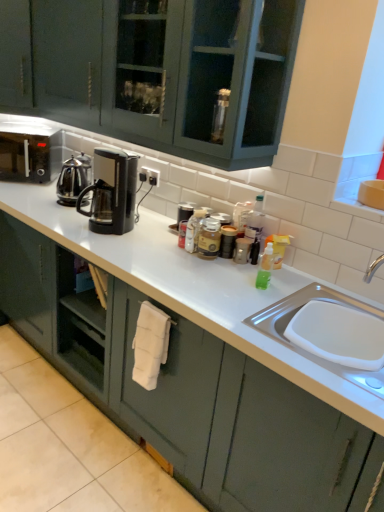
Question: Does black plastic coffee maker at center, which ranks as the 2th kitchen appliance in left-to-right order, have a lesser width compared to metallic silver canister at center, which is the first appliance from back to front?

Choices:
 (A) no
 (B) yes

Answer: (A)

Question: Is black plastic coffee maker at center, which is the 2th kitchen appliance from back to front, turned away from metallic silver canister at center, which appears as the second appliance when viewed from the right?

Choices:
 (A) no
 (B) yes

Answer: (A)

Question: Considering the relative positions of black plastic coffee maker at center, which ranks as the 2th kitchen appliance in left-to-right order, and metallic silver canister at center, acting as the first appliance starting from the top, in the image provided, is black plastic coffee maker at center, which ranks as the 2th kitchen appliance in left-to-right order, to the right of metallic silver canister at center, acting as the first appliance starting from the top, from the viewer's perspective?

Choices:
 (A) no
 (B) yes

Answer: (A)

Question: Considering the relative positions of black plastic coffee maker at center, the first kitchen appliance viewed from the right, and metallic silver canister at center, acting as the first appliance starting from the top, in the image provided, is black plastic coffee maker at center, the first kitchen appliance viewed from the right, in front of metallic silver canister at center, acting as the first appliance starting from the top,?

Choices:
 (A) no
 (B) yes

Answer: (B)

Question: Is the depth of black plastic coffee maker at center, the first kitchen appliance viewed from the right, greater than that of metallic silver canister at center, which is the first appliance from back to front?

Choices:
 (A) yes
 (B) no

Answer: (B)

Question: Is black plastic coffee maker at center, which is the 2th kitchen appliance from back to front, positioned beyond the bounds of metallic silver canister at center, which is the 2th appliance in front-to-back order?

Choices:
 (A) no
 (B) yes

Answer: (B)

Question: Is polished stainless steel kettle at left, the first kitchen appliance viewed from the left, touching matte green cabinet at center?

Choices:
 (A) yes
 (B) no

Answer: (B)

Question: Does polished stainless steel kettle at left, the 2th kitchen appliance positioned from the right, lie in front of matte green cabinet at center?

Choices:
 (A) no
 (B) yes

Answer: (A)

Question: Is the depth of polished stainless steel kettle at left, the 2th kitchen appliance positioned from the right, greater than that of matte green cabinet at center?

Choices:
 (A) no
 (B) yes

Answer: (B)

Question: From the image's perspective, is polished stainless steel kettle at left, the first kitchen appliance viewed from the back, above matte green cabinet at center?

Choices:
 (A) yes
 (B) no

Answer: (A)

Question: Can you confirm if polished stainless steel kettle at left, the 2th kitchen appliance viewed from the front, is wider than matte green cabinet at center?

Choices:
 (A) yes
 (B) no

Answer: (B)

Question: Is matte green cabinet at center surrounded by polished stainless steel kettle at left, the 2th kitchen appliance viewed from the front?

Choices:
 (A) no
 (B) yes

Answer: (A)

Question: Does metallic silver canister at center, which appears as the first appliance when ordered from the bottom, have a smaller size compared to black matte microwave at left?

Choices:
 (A) no
 (B) yes

Answer: (B)